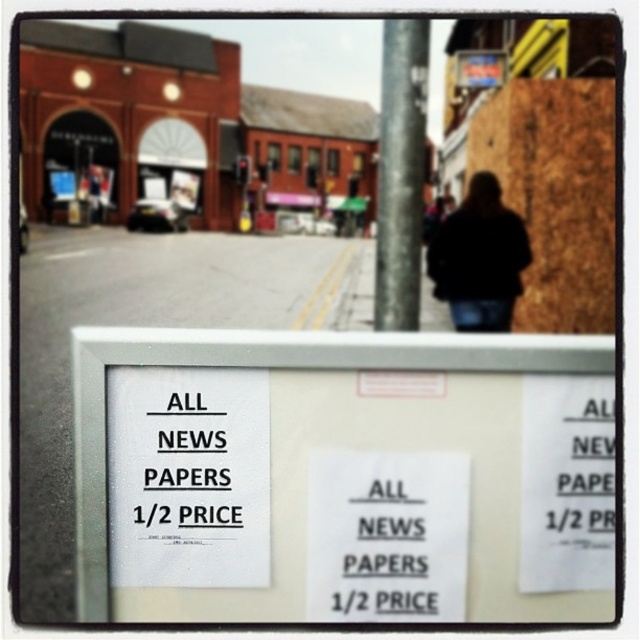
You are a pedestrian standing on the sidewalk looking at the street scene. You see a white paper sign at lower center and a black fabric at center. Which object is closer to the viewer?

The white paper sign at lower center is closer to the viewer because it is positioned under the black fabric at center, meaning it is in front of the black fabric.

You are standing in front of the signboard and want to locate the point with coordinates (342, 476). According to the scene description, where exactly would this point be located?

The point with coordinates (342, 476) is on the white paper sign at center.